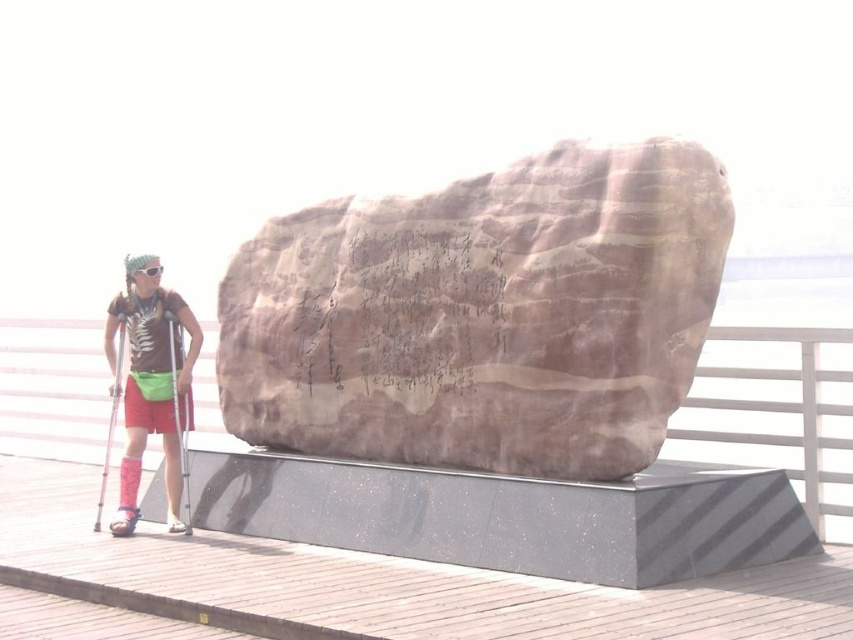
Looking at this image, you are standing on the wooden walkway and want to place a small potted plant exactly where the brown polished stone at center is currently positioned. Is the location suitable for placing the plant?

The brown polished stone at center is located at point (483, 314), so yes, the location is suitable for placing the plant as it is precisely at the specified coordinates.

You are standing at the point marked by the coordinates point (x=483, y=314) in the image. What object are you directly facing?

The point (x=483, y=314) marks the brown polished stone at center, so you are directly facing the brown polished stone at center.

You are a photographer trying to capture the brown polished stone at center and the matte brown shirt at center in a single frame. Which object should you focus on first if you want to ensure both are in focus, considering their relative sizes and positions?

The brown polished stone at center is taller than the matte brown shirt at center, so focusing on the stone first would help ensure both are in focus as it is the larger and closer object.